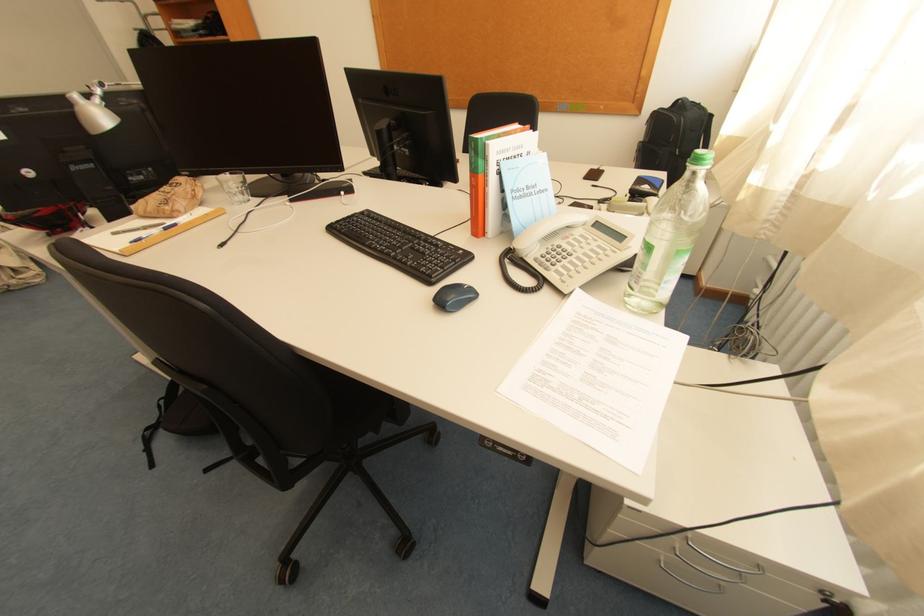
This screenshot has width=924, height=616. What do you see at coordinates (96, 107) in the screenshot?
I see `a desk lamp head` at bounding box center [96, 107].